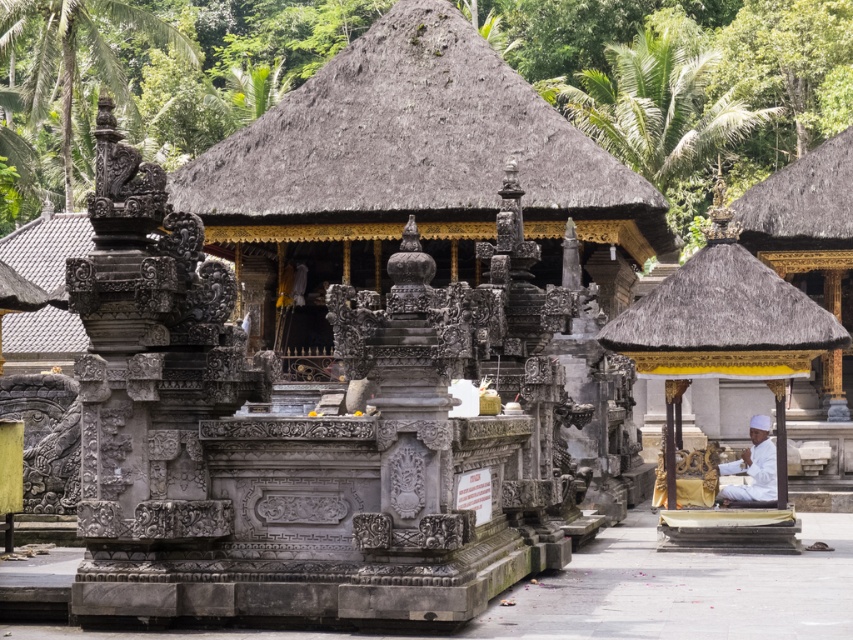
You are a visitor in the temple complex and want to take a photo of the thatched roof at center and the thatched roof gazebo at right. Which one should you focus on first if you want to capture both in the same frame without moving your camera?

The thatched roof at center is located above the thatched roof gazebo at right, so you should focus on the thatched roof gazebo at right first to ensure both are in the frame.

You are standing at the entrance of the Balinese temple complex. You want to take a photo of the point at coordinates point (711,323). If your camera has a maximum zoom range of 30 meters, will you be able to capture the point clearly in your photo?

The point at coordinates point (711,323) is 31.40 meters away from the camera. Since the camera can only zoom up to 30 meters, it will not be able to capture the point clearly at this distance.

You are a visitor standing in front of the central structure in the Balinese temple complex. You notice two thatched roofs in the scene. Which one is positioned to the left when comparing the thatched roof at center and the brown thatch roof at upper right?

The thatched roof at center is positioned to the left of the brown thatch roof at upper right.